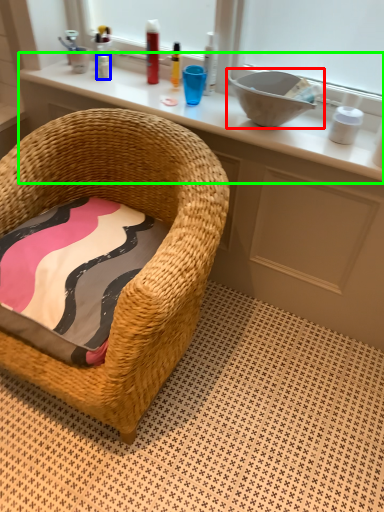
Question: Which object is the farthest from sink (highlighted by a red box)? Choose among these: toiletry (highlighted by a blue box) or changing table (highlighted by a green box).

Choices:
 (A) toiletry
 (B) changing table

Answer: (A)